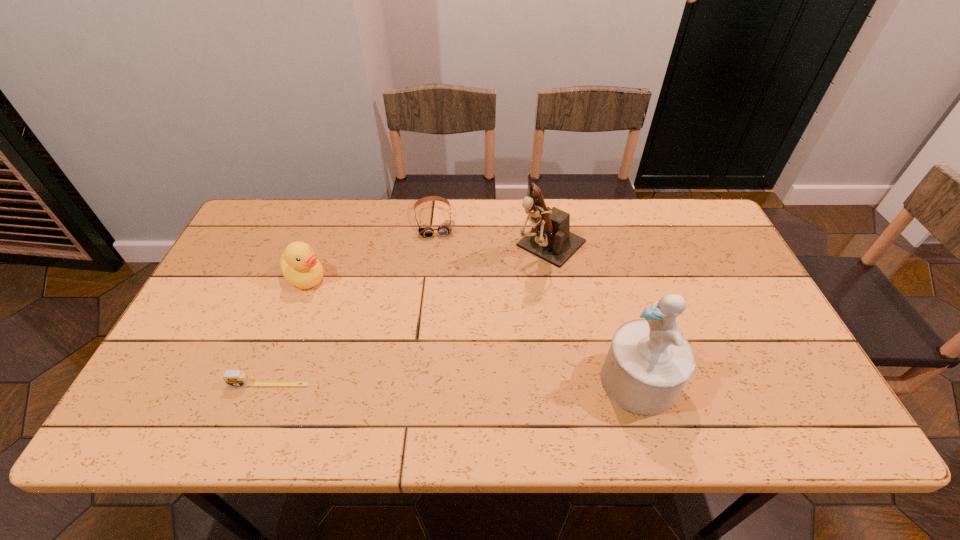
The height and width of the screenshot is (540, 960). I want to click on free space between the duck and the nearer figurine, so click(x=472, y=329).

Locate an element on the screen. free space between the tape measure and the farther figurine is located at coordinates (410, 315).

At what (x,y) coordinates should I click in order to perform the action: click on free spot between the third object from left to right and the farther figurine. Please return your answer as a coordinate pair (x, y). Image resolution: width=960 pixels, height=540 pixels. Looking at the image, I should click on (492, 234).

At what (x,y) coordinates should I click in order to perform the action: click on blank region between the third tallest object and the farther figurine. Please return your answer as a coordinate pair (x, y). Looking at the image, I should click on (428, 261).

You are a GUI agent. You are given a task and a screenshot of the screen. Output one action in this format:
    pyautogui.click(x=<x>, y=<y>)
    Task: Click on the empty location between the farther figurine and the nearer figurine
    
    Given the screenshot: What is the action you would take?
    pyautogui.click(x=595, y=314)

The height and width of the screenshot is (540, 960). I want to click on vacant space that's between the farther figurine and the shortest object, so click(410, 315).

Locate an element on the screen. Image resolution: width=960 pixels, height=540 pixels. vacant space that is in between the nearer figurine and the farther figurine is located at coordinates (595, 314).

You are a GUI agent. You are given a task and a screenshot of the screen. Output one action in this format:
    pyautogui.click(x=<x>, y=<y>)
    Task: Click on the free space between the duck and the third object from right to left
    The image size is (960, 540).
    Given the screenshot: What is the action you would take?
    pyautogui.click(x=371, y=249)

The width and height of the screenshot is (960, 540). In order to click on object that is the fourth closest to the farther figurine in this screenshot , I will do `click(233, 378)`.

Where is `object that can be found as the closest to the farther figurine`? The height and width of the screenshot is (540, 960). object that can be found as the closest to the farther figurine is located at coordinates pos(446,227).